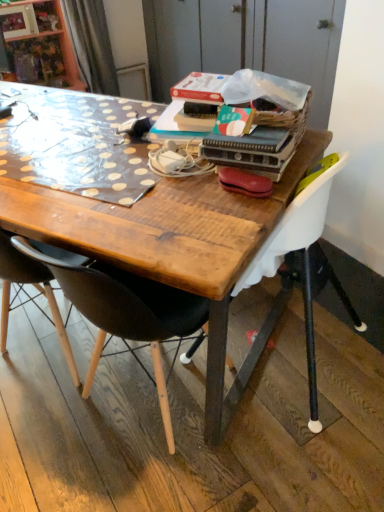
Where is `vacant space to the right of white plastic chair at upper right, placed as the second chair when sorted from left to right`? vacant space to the right of white plastic chair at upper right, placed as the second chair when sorted from left to right is located at coordinates (356, 317).